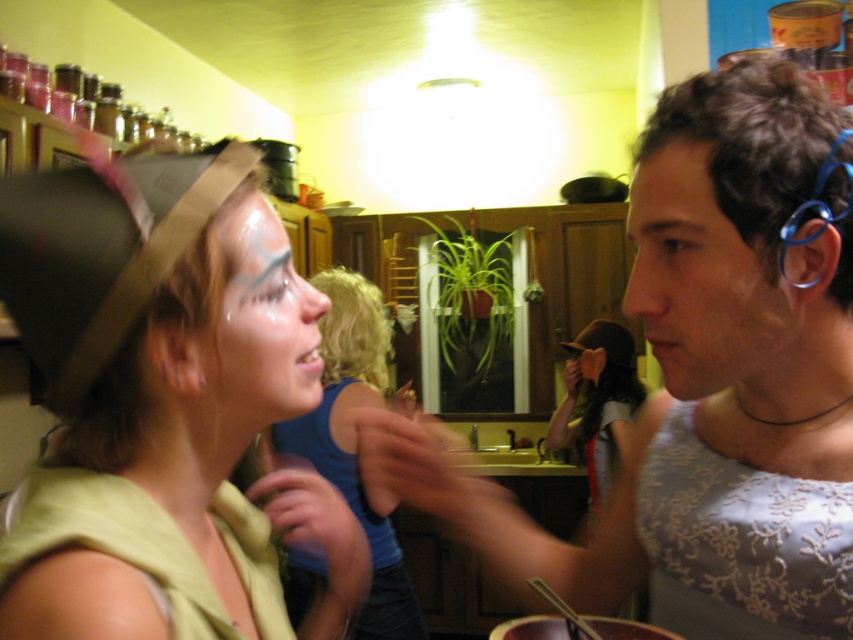
Which is more to the left, matte green fabric at center or glossy white face paint at center?

matte green fabric at center

Is matte green fabric at center positioned behind glossy white face paint at center?

No, it is not.

Locate an element on the screen. This screenshot has width=853, height=640. matte green fabric at center is located at coordinates (164, 410).

Does matte gray tank top at center appear on the left side of matte green fabric at center?

No, matte gray tank top at center is not to the left of matte green fabric at center.

Can you confirm if matte gray tank top at center is shorter than matte green fabric at center?

In fact, matte gray tank top at center may be taller than matte green fabric at center.

This screenshot has height=640, width=853. I want to click on matte gray tank top at center, so click(x=705, y=381).

Where is `matte gray tank top at center`? matte gray tank top at center is located at coordinates (705, 381).

Is blue fabric shirt at center closer to the viewer compared to glossy white face paint at center?

No, blue fabric shirt at center is further to the viewer.

Who is positioned more to the left, blue fabric shirt at center or glossy white face paint at center?

blue fabric shirt at center is more to the left.

Measure the distance between point (344, 328) and camera.

The distance of point (344, 328) from camera is 6.98 feet.

At what (x,y) coordinates should I click in order to perform the action: click on blue fabric shirt at center. Please return your answer as a coordinate pair (x, y). This screenshot has width=853, height=640. Looking at the image, I should click on (354, 442).